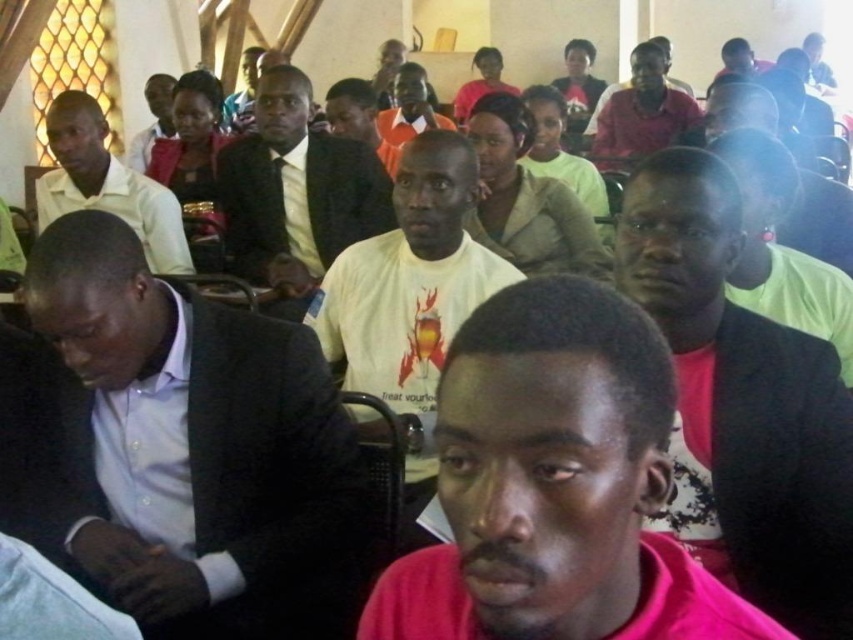
Question: Estimate the real-world distances between objects in this image. Which object is farther from the light blue fabric shirt at left?

Choices:
 (A) light blue shirt at center
 (B) white t-shirt at center

Answer: (B)

Question: Which is farther from the light blue shirt at center?

Choices:
 (A) matte black suit at center
 (B) pink fabric shirt at center
 (C) light blue fabric shirt at left
 (D) pink matte shirt at center

Answer: (A)

Question: Can you confirm if pink fabric shirt at center is positioned above white t-shirt at center?

Choices:
 (A) yes
 (B) no

Answer: (B)

Question: In this image, where is light blue shirt at center located relative to matte red shirt at upper center?

Choices:
 (A) right
 (B) left

Answer: (B)

Question: Which point is closer to the camera?

Choices:
 (A) white t-shirt at center
 (B) light blue shirt at center
 (C) pink matte shirt at center

Answer: (C)

Question: Is light blue shirt at center further to the viewer compared to matte black suit at center?

Choices:
 (A) no
 (B) yes

Answer: (A)